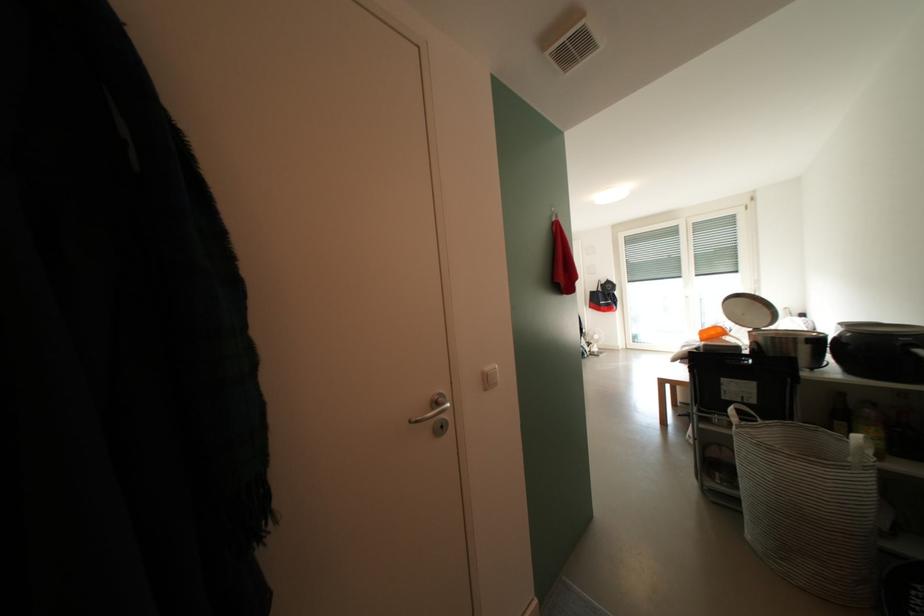
At what (x,y) coordinates should I click in order to perform the action: click on white light switch. Please return your answer as a coordinate pair (x, y). The height and width of the screenshot is (616, 924). Looking at the image, I should click on click(x=490, y=379).